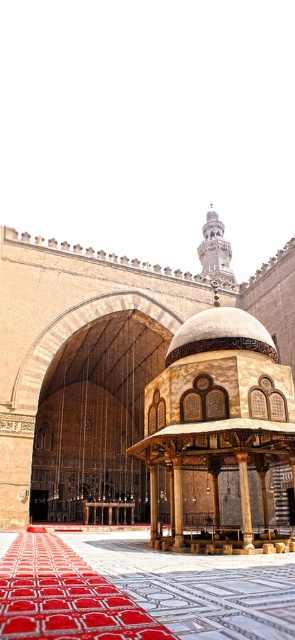
You are standing inside the grand mosque and want to take a photo of the point at coordinates (179, 547). If your camera has a maximum focus range of 100 feet, will it be able to focus on that point?

The point at coordinates (179, 547) is 104.17 feet away from the viewer, which exceeds the camera maximum focus range of 100 feet. Therefore, the camera will not be able to focus on that point.

In the scene shown: You are a visitor standing at the entrance of the mosque. You see the red carpet at center and the brown polished wood pillar at center. Which object is closer to you?

The red carpet at center is closer to you because it is positioned above the brown polished wood pillar at center, indicating it is in a more forward plane.